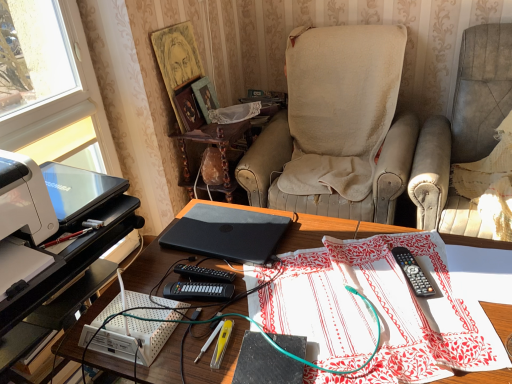
Locate an element on the screen. Image resolution: width=512 pixels, height=384 pixels. vacant space that's between orange matte laptop at center, placed as the 2th laptop when sorted from left to right, and black plastic remote control at center, the 1th stationery from the right is located at coordinates (334, 260).